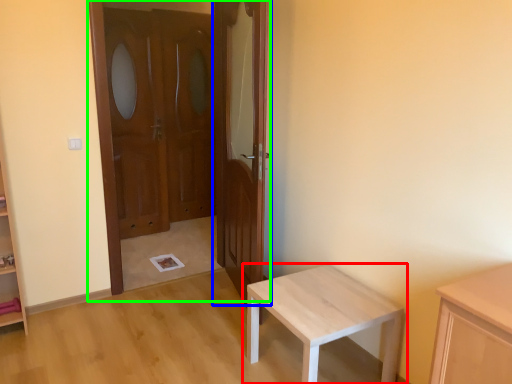
Question: Which object is the closest to the table (highlighted by a red box)? Choose among these: door (highlighted by a blue box) or door (highlighted by a green box).

Choices:
 (A) door
 (B) door

Answer: (A)